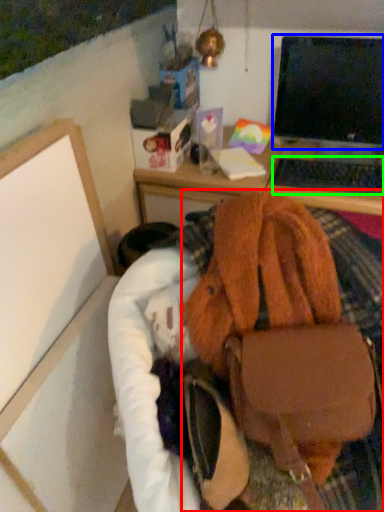
Question: Which object is positioned farthest from handbag (highlighted by a red box)? Select from computer monitor (highlighted by a blue box) and computer keyboard (highlighted by a green box).

Choices:
 (A) computer monitor
 (B) computer keyboard

Answer: (A)